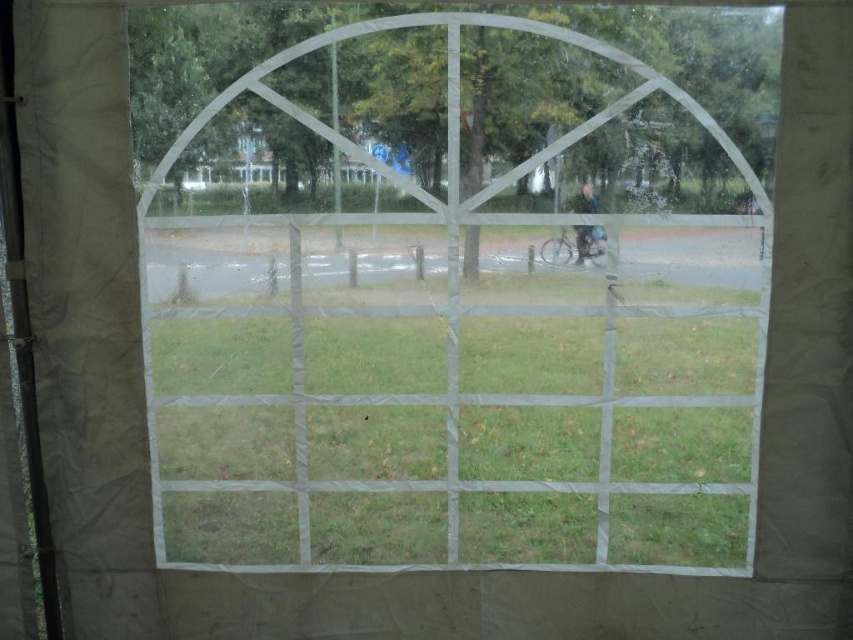
Between transparent plastic window at center and green grass at center, which one has less height?

green grass at center

Which is more to the left, transparent plastic window at center or green grass at center?

green grass at center is more to the left.

Between point (554, 35) and point (338, 492), which one is positioned in front?

Point (554, 35) is in front.

Identify the location of transparent plastic window at center. The height and width of the screenshot is (640, 853). (457, 323).